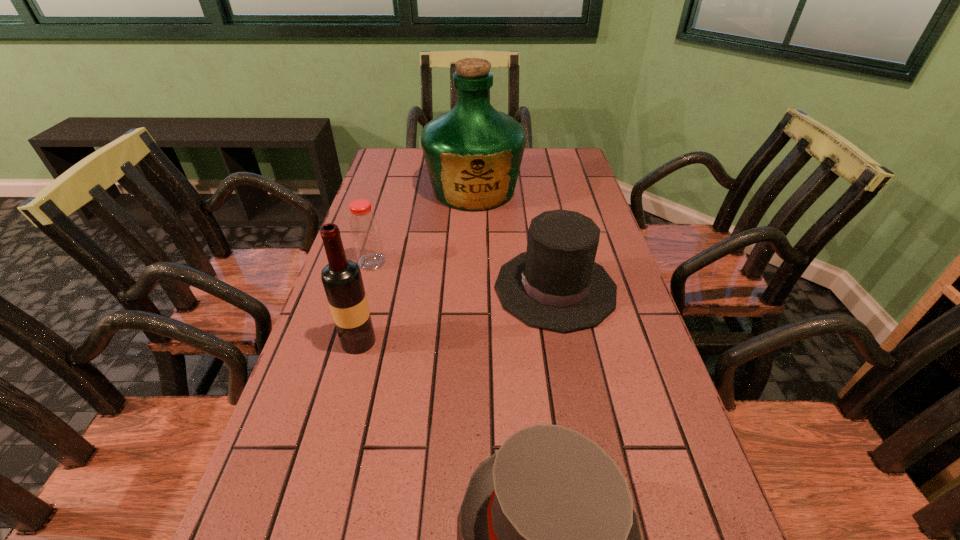
The width and height of the screenshot is (960, 540). I want to click on free space located 0.090m on the right of the bottle, so click(420, 262).

Find the location of a particular element. object present at the far edge is located at coordinates (473, 153).

This screenshot has width=960, height=540. Identify the location of wine bottle present at the left edge. (342, 280).

The height and width of the screenshot is (540, 960). What are the coordinates of `bottle that is at the left edge` in the screenshot? It's located at [x=365, y=232].

At what (x,y) coordinates should I click in order to perform the action: click on object situated at the right edge. Please return your answer as a coordinate pair (x, y). The image size is (960, 540). Looking at the image, I should click on (556, 285).

In order to click on vacant space at the left edge of the desktop in this screenshot , I will do point(319,372).

Find the location of a particular element. The height and width of the screenshot is (540, 960). vacant space at the right edge of the desktop is located at coordinates (576, 210).

The width and height of the screenshot is (960, 540). Identify the location of free space that is in between the farther dress hat and the farthest object. (515, 239).

Locate an element on the screen. This screenshot has height=540, width=960. empty location between the farther dress hat and the fourth shortest object is located at coordinates (457, 315).

What are the coordinates of `free spot between the liquor and the farther dress hat` in the screenshot? It's located at [x=515, y=239].